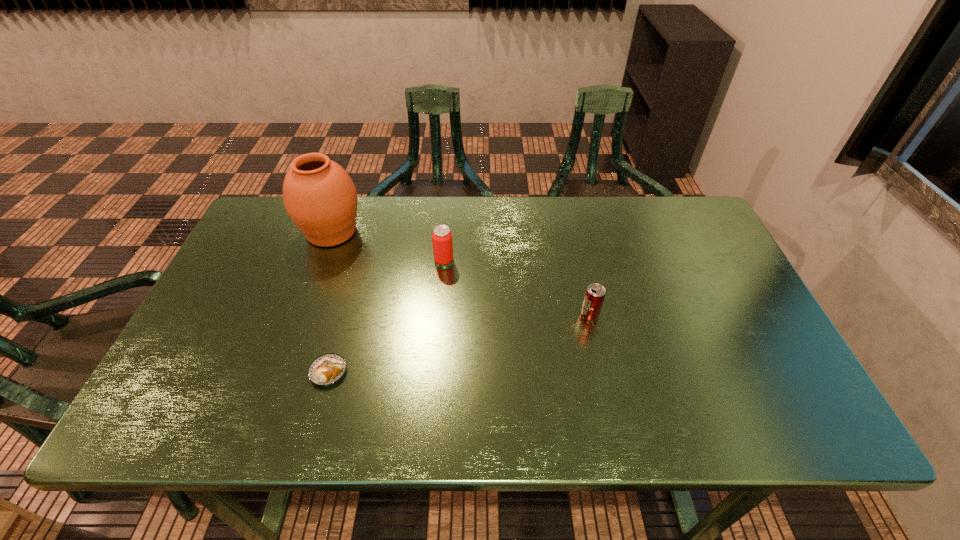
Locate an element on the screen. The width and height of the screenshot is (960, 540). urn is located at coordinates (319, 196).

Locate an element on the screen. The width and height of the screenshot is (960, 540). the third object from left to right is located at coordinates (442, 242).

Where is `the left beer can`? The width and height of the screenshot is (960, 540). the left beer can is located at coordinates (442, 242).

Where is `the second nearest object`? The width and height of the screenshot is (960, 540). the second nearest object is located at coordinates tap(594, 297).

Locate an element on the screen. This screenshot has width=960, height=540. the rightmost object is located at coordinates (594, 297).

Image resolution: width=960 pixels, height=540 pixels. Identify the location of the shortest object. (327, 369).

At what (x,y) coordinates should I click in order to perform the action: click on pastry. Please return your answer as a coordinate pair (x, y). Looking at the image, I should click on (327, 369).

The height and width of the screenshot is (540, 960). I want to click on vacant area located on the front of the urn, so click(300, 319).

What are the coordinates of `vacant space located on the left of the left beer can` in the screenshot? It's located at (301, 260).

Locate an element on the screen. The height and width of the screenshot is (540, 960). free location located 0.170m on the front of the shorter beer can is located at coordinates (605, 382).